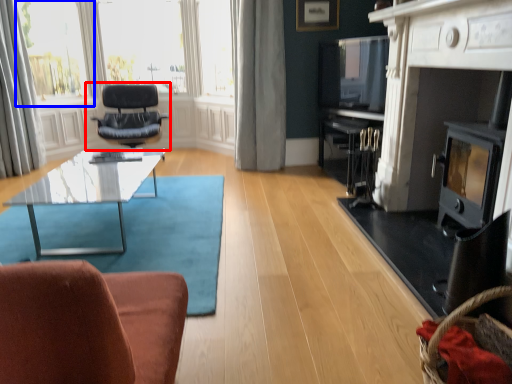
Question: Which object appears closest to the camera in this image, chair (highlighted by a red box) or bay window (highlighted by a blue box)?

Choices:
 (A) chair
 (B) bay window

Answer: (A)